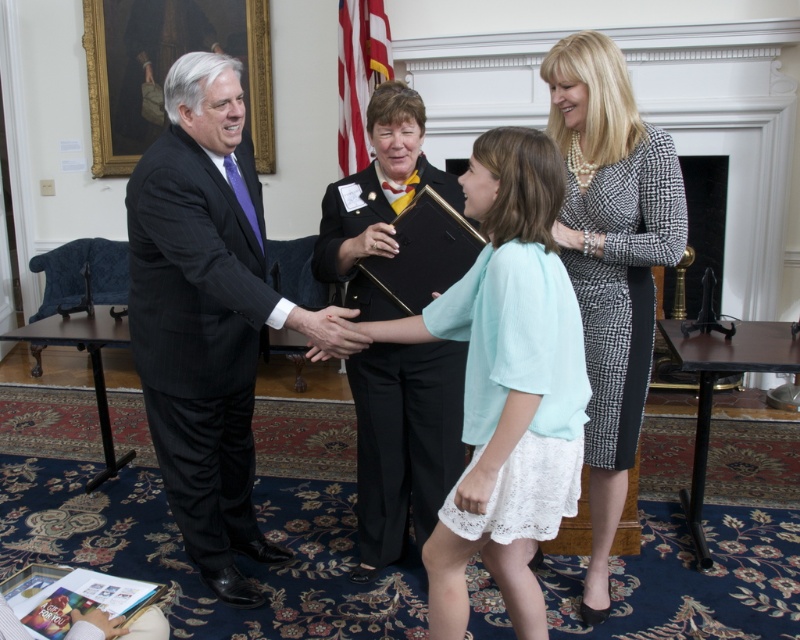
Question: Which point is farther to the camera?

Choices:
 (A) (604, 259)
 (B) (192, 216)
 (C) (592, 276)

Answer: (C)

Question: Which of these objects is positioned closest to the black fabric jacket at center?

Choices:
 (A) patterned dress at center
 (B) matte black book at center
 (C) black pinstripe suit at left
 (D) light blue lace dress at center

Answer: (C)

Question: Can you confirm if light blue lace dress at center is positioned to the left of matte black book at center?

Choices:
 (A) yes
 (B) no

Answer: (A)

Question: Can you confirm if black pinstripe suit at left is wider than light blue lace dress at center?

Choices:
 (A) yes
 (B) no

Answer: (A)

Question: Which point is closer to the camera taking this photo?

Choices:
 (A) (314, 262)
 (B) (622, 337)
 (C) (578, 317)
 (D) (684, 234)

Answer: (C)

Question: Is black pinstripe suit at left positioned before light blue lace dress at center?

Choices:
 (A) no
 (B) yes

Answer: (A)